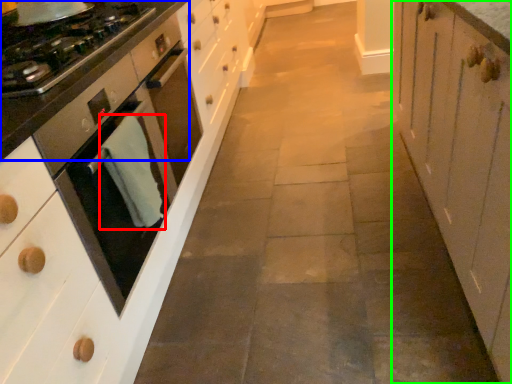
Question: Which is nearer to the material (highlighted by a red box)? countertop (highlighted by a blue box) or cabinetry (highlighted by a green box).

Choices:
 (A) countertop
 (B) cabinetry

Answer: (A)